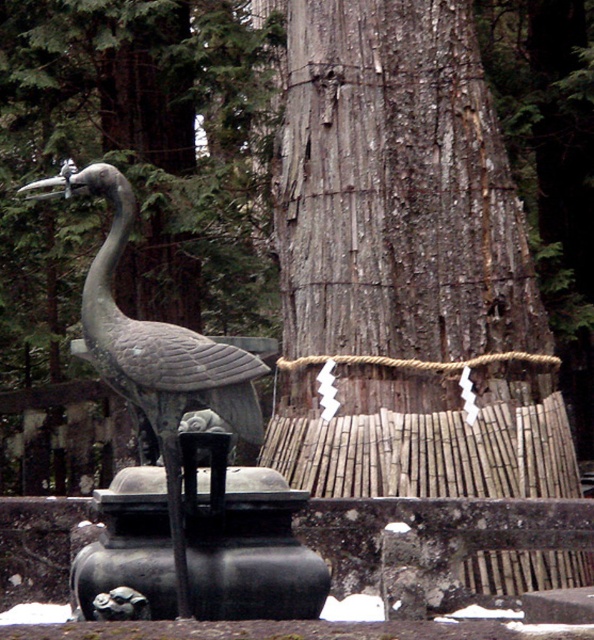
Question: Is gray textured wood at center wider than green patina statue at left?

Choices:
 (A) no
 (B) yes

Answer: (B)

Question: Does gray textured wood at center appear on the left side of green patina statue at left?

Choices:
 (A) no
 (B) yes

Answer: (A)

Question: Which point is closer to the camera taking this photo?

Choices:
 (A) (317, 253)
 (B) (108, 301)

Answer: (B)

Question: Does gray textured wood at center appear on the right side of green patina statue at left?

Choices:
 (A) no
 (B) yes

Answer: (B)

Question: Which point is farther to the camera?

Choices:
 (A) green patina statue at left
 (B) gray textured wood at center

Answer: (B)